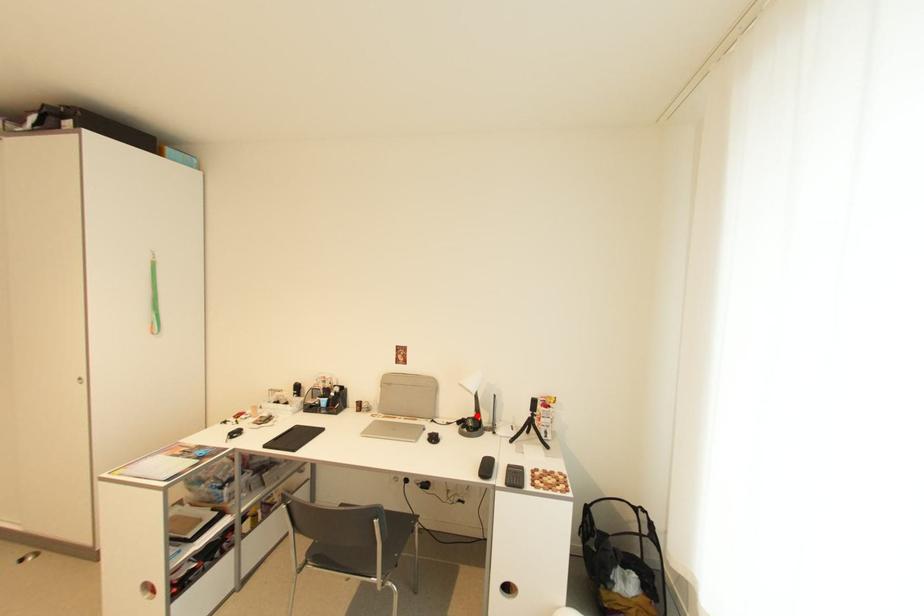
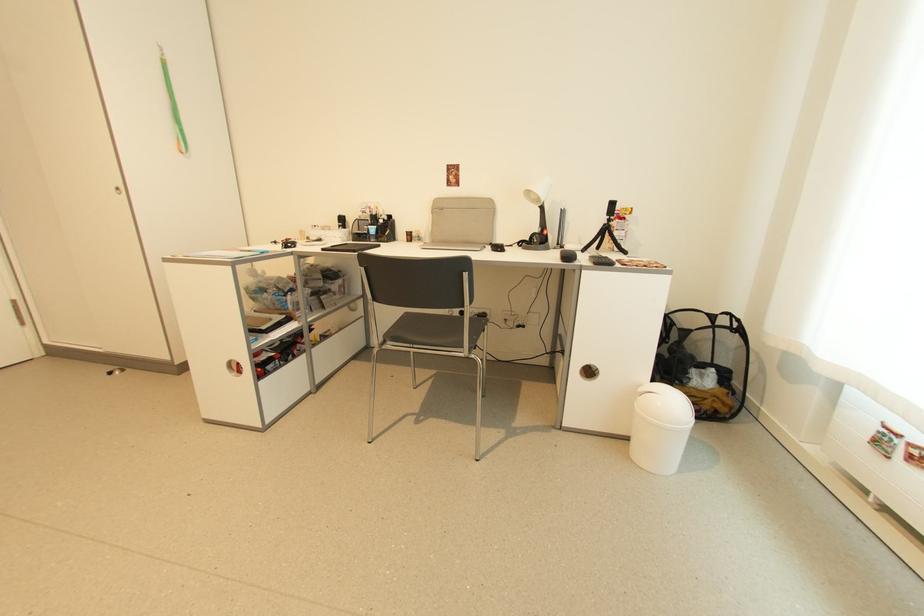
Locate, in the second image, the point that corresponds to the highlighted location in the first image.

(541, 232)